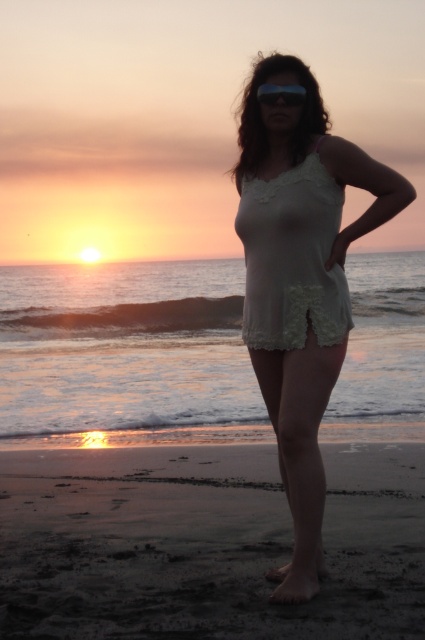
Who is more distant from viewer, (363, 172) or (268, 86)?

The point (268, 86) is more distant.

Between white lace top at center and transparent plastic goggles at center, which one has more height?

Standing taller between the two is white lace top at center.

Between point (309, 291) and point (268, 83), which one is positioned in front?

Point (309, 291)

The image size is (425, 640). I want to click on white lace top at center, so click(302, 285).

Can you confirm if sandy beach at lower center is positioned above white lace dress at center?

No, sandy beach at lower center is not above white lace dress at center.

From the picture: Who is more forward, (141, 480) or (238, 228)?

Point (238, 228) is more forward.

At what (x,y) coordinates should I click in order to perform the action: click on sandy beach at lower center. Please return your answer as a coordinate pair (x, y). Looking at the image, I should click on (204, 541).

Can you confirm if white lace top at center is wider than white lace dress at center?

Yes.

Is white lace top at center taller than white lace dress at center?

Indeed, white lace top at center has a greater height compared to white lace dress at center.

Measure the distance between white lace top at center and camera.

white lace top at center and camera are 4.43 meters apart.

Find the location of `white lace top at center`. white lace top at center is located at coordinates (302, 285).